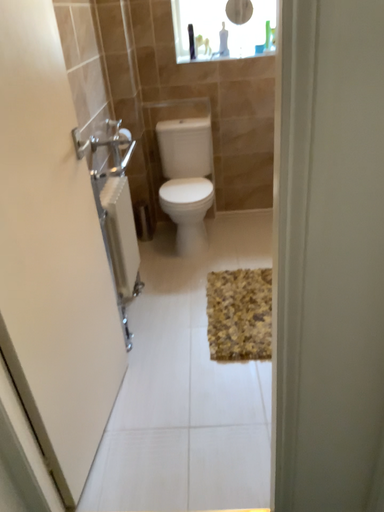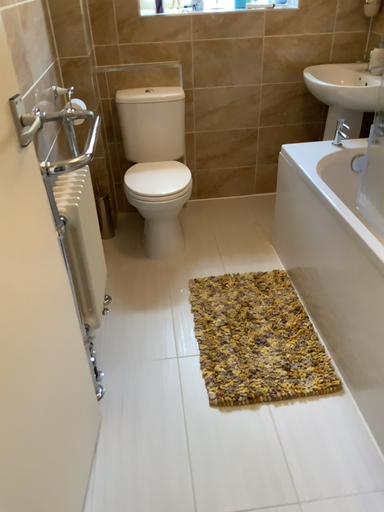
Question: Which way did the camera rotate in the video?

Choices:
 (A) rotated left
 (B) rotated right

Answer: (B)